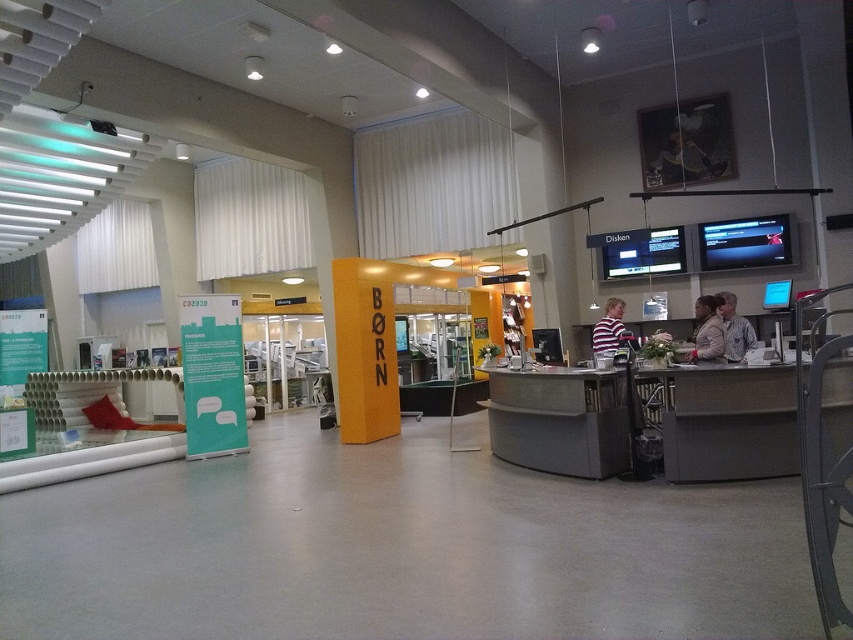
You are organizing an event and need to place a light beige jacket at lower right on a matte gray desk at center. Will the jacket fit on the desk?

The matte gray desk at center is wider than the light beige jacket at lower right, so the jacket will fit on the desk.

You are a visitor entering the building and need to locate both the metallic gray desk at center and the matte gray desk at center. According to the scene, which desk should you look to the right of to find the other?

The metallic gray desk at center is to the right of the matte gray desk at center, so you should look to the right of the matte gray desk at center to find the metallic gray desk at center.

You are a customer in a store and you see a leather jacket at center and a striped fabric shirt at center. You want to pick up both items to try them on. Which item is closer to your current position?

The leather jacket at center is 1.04 meters away from the striped fabric shirt at center. Since both items are at the center, their distance from your position depends on where you are standing. However, the question states you want to pick up both items, implying you need to move towards them. Since the jacket and shirt are both at the center, they are equally distant from your current position if you are equidistant from both. However, the description only provides the distance between the two items, not